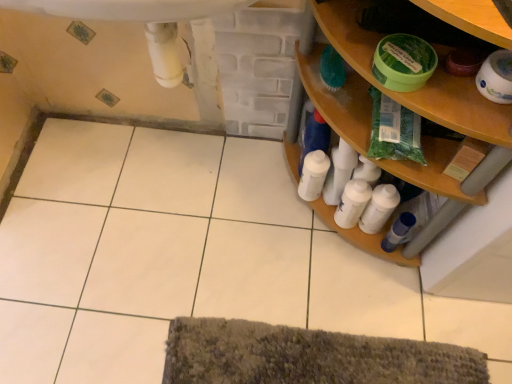
This screenshot has height=384, width=512. I want to click on free space in front of white glossy bottle at lower right, the 3th toiletry viewed from the right, so coord(307,250).